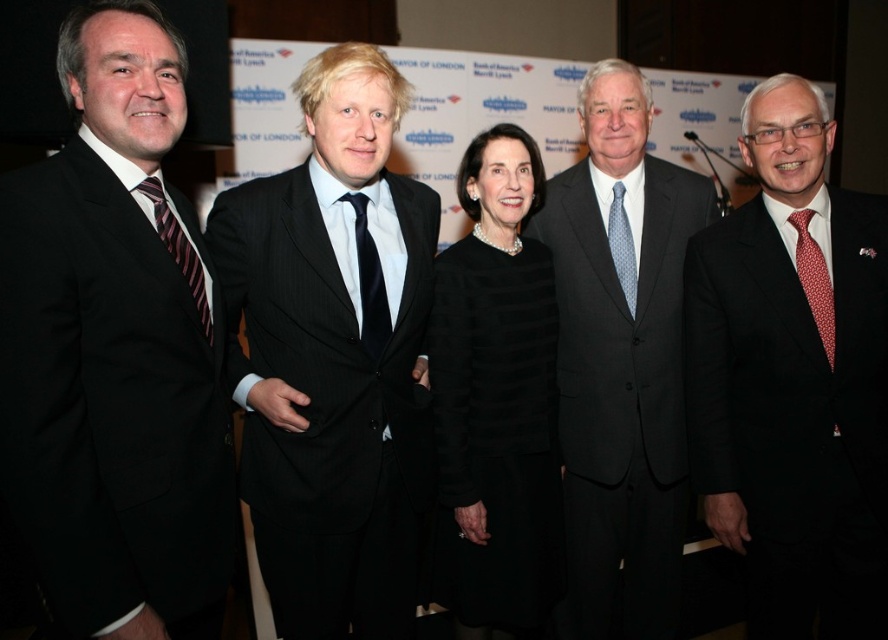
Question: Considering the real-world distances, which object is closest to the black silk tie at center?

Choices:
 (A) striped silk tie at left
 (B) matte black suit at left
 (C) blue dotted tie at center
 (D) matte black suit at right

Answer: (A)

Question: Which point is closer to the camera taking this photo?

Choices:
 (A) (740, 461)
 (B) (102, 244)

Answer: (B)

Question: Which point is farther from the camera taking this photo?

Choices:
 (A) (879, 230)
 (B) (628, 227)
 (C) (359, 216)

Answer: (B)

Question: Can you confirm if matte black suit at center is smaller than black silk tie at center?

Choices:
 (A) no
 (B) yes

Answer: (A)

Question: Does matte black suit at left appear on the right side of blue dotted tie at center?

Choices:
 (A) yes
 (B) no

Answer: (B)

Question: Does matte black suit at left come in front of striped silk tie at left?

Choices:
 (A) yes
 (B) no

Answer: (A)